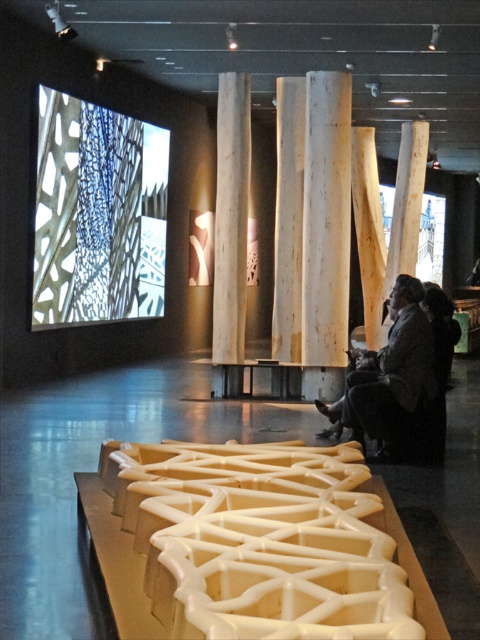
You are an art curator planning to place a new sculpture in the exhibition space. The sculpture requires a spot that is not occupied by the dark gray fabric at lower right. Based on the coordinates provided, where should you position the sculpture to avoid overlapping with the fabric?

The dark gray fabric at lower right is located at point (387, 378), so you should position the sculpture away from that coordinate to avoid overlapping.

You are an art curator standing in the exhibition space and want to place a new sculpture between the dark gray fabric at lower right and the natural wood pillar at center. Based on their positions, where should the sculpture be placed?

The dark gray fabric at lower right is located below the natural wood pillar at center, so the sculpture should be placed between them in the space below the natural wood pillar at center and above the dark gray fabric at lower right.

You are an art curator standing in the exhibition space. You notice two points marked in the image. The first point is at coordinates point (369, 429) and the second is at point (248, 180). Which of these points is closer to you as you face the installation in the center?

Point (369, 429) is closer to you because it is in front of point (248, 180).